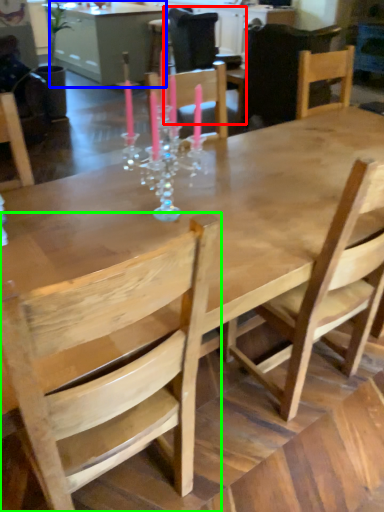
Question: Based on their relative distances, which object is farther from chair (highlighted by a red box)? Choose from table (highlighted by a blue box) and chair (highlighted by a green box).

Choices:
 (A) table
 (B) chair

Answer: (B)